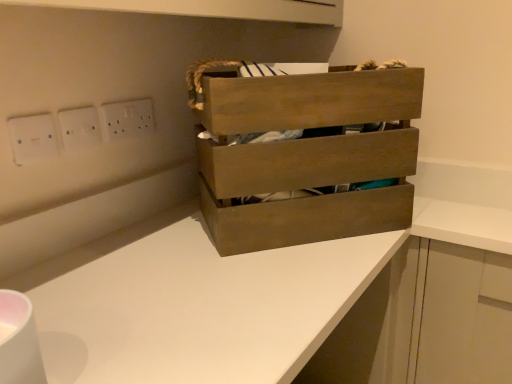
Question: From the image's perspective, relative to white plastic socket at upper left, arranged as the 2th electric outlet when viewed from the left, is white plastic electrical outlet at upper left, placed as the first electric outlet when sorted from left to right, above or below?

Choices:
 (A) above
 (B) below

Answer: (B)

Question: Does point (46, 135) appear closer or farther from the camera than point (83, 132)?

Choices:
 (A) closer
 (B) farther

Answer: (A)

Question: Which is farther from the white plastic socket at upper left, positioned as the 2th electric outlet in back-to-front order?

Choices:
 (A) wooden crate at center
 (B) white plastic electrical outlet at upper left, arranged as the 3th electric outlet when viewed from the back
 (C) white plastic electric outlet at upper center, positioned as the first electric outlet in back-to-front order
 (D) white matte counter at center

Answer: (D)

Question: Estimate the real-world distances between objects in this image. Which object is farther from the white matte counter at center?

Choices:
 (A) white plastic electric outlet at upper center, the third electric outlet in the front-to-back sequence
 (B) white plastic electrical outlet at upper left, placed as the 1th electric outlet when sorted from front to back
 (C) wooden crate at center
 (D) white plastic socket at upper left, positioned as the 2th electric outlet in back-to-front order

Answer: (B)